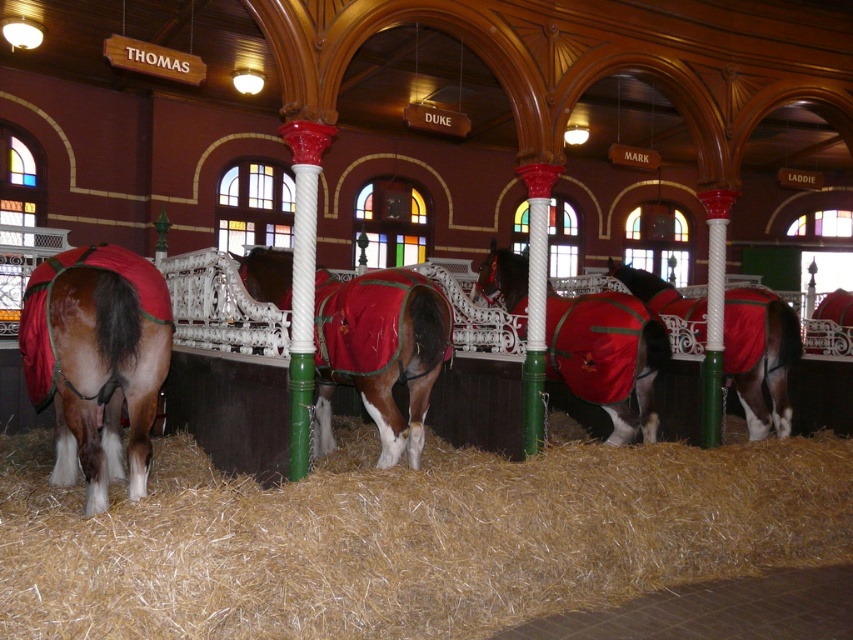
Describe the element at coordinates (96, 362) in the screenshot. I see `shiny brown horse at left` at that location.

Between shiny brown horse at left and shiny red blanket at center, which one appears on the right side from the viewer's perspective?

shiny red blanket at center

Is point (108, 374) positioned after point (616, 314)?

No, (108, 374) is in front of (616, 314).

I want to click on shiny brown horse at left, so click(96, 362).

Is point (195, 460) farther from viewer compared to point (746, 310)?

No, it is not.

Who is more distant from viewer, (834,483) or (738,356)?

Point (738,356)

Find the location of a particular element. This screenshot has height=640, width=853. golden straw at lower center is located at coordinates (405, 538).

Can you confirm if golden straw at lower center is positioned below shiny red blanket at center?

Yes, golden straw at lower center is below shiny red blanket at center.

Who is more forward, (x=532, y=460) or (x=619, y=364)?

Point (x=532, y=460) is in front.

Is point (380, 532) positioned after point (564, 358)?

No.

At what (x,y) coordinates should I click in order to perform the action: click on golden straw at lower center. Please return your answer as a coordinate pair (x, y). The height and width of the screenshot is (640, 853). Looking at the image, I should click on (405, 538).